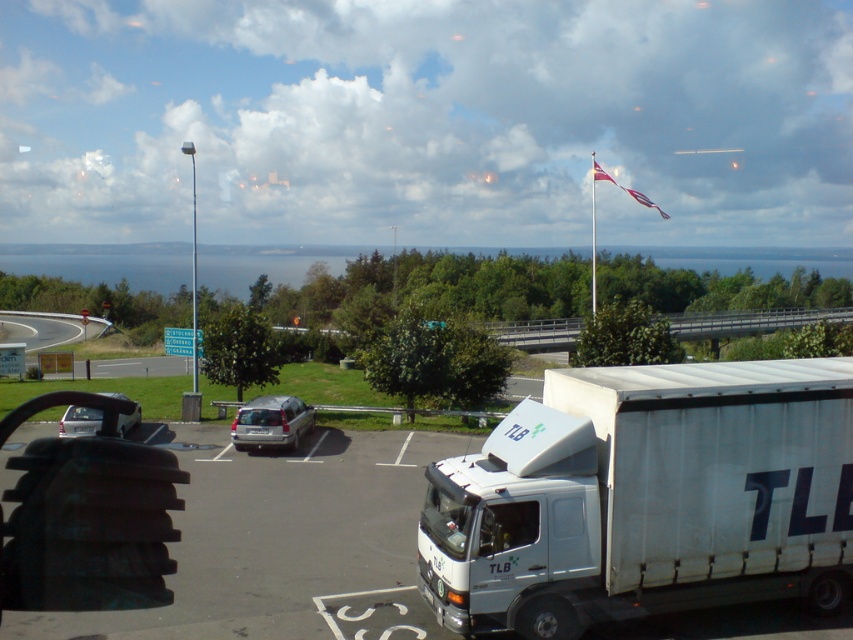
Does point (689, 572) come farther from viewer compared to point (30, 346)?

No, (689, 572) is closer to viewer.

Who is shorter, white matte trailer truck at lower right or gray asphalt road at lower left?

gray asphalt road at lower left is shorter.

Is point (646, 468) closer to camera compared to point (67, 326)?

Yes, it is in front of point (67, 326).

Where is `white matte trailer truck at lower right`? The image size is (853, 640). white matte trailer truck at lower right is located at coordinates (646, 497).

Which is above, silver metallic van at center or gray asphalt road at lower left?

gray asphalt road at lower left is above.

Can you confirm if silver metallic van at center is wider than gray asphalt road at lower left?

Incorrect, silver metallic van at center's width does not surpass gray asphalt road at lower left's.

The height and width of the screenshot is (640, 853). Describe the element at coordinates (271, 422) in the screenshot. I see `silver metallic van at center` at that location.

Where is `silver metallic van at center`? This screenshot has height=640, width=853. silver metallic van at center is located at coordinates (271, 422).

Describe the element at coordinates (271, 422) in the screenshot. I see `silver metallic van at center` at that location.

Is point (288, 448) less distant than point (132, 422)?

Yes, point (288, 448) is in front of point (132, 422).

What are the coordinates of `silver metallic van at center` in the screenshot? It's located at click(271, 422).